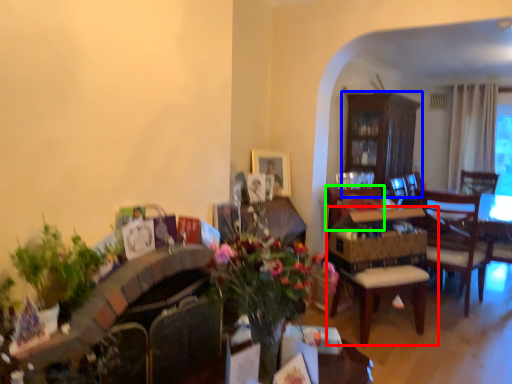
Question: Which object is the closest to the chair (highlighted by a red box)? Choose among these: cabinetry (highlighted by a blue box) or armchair (highlighted by a green box).

Choices:
 (A) cabinetry
 (B) armchair

Answer: (B)